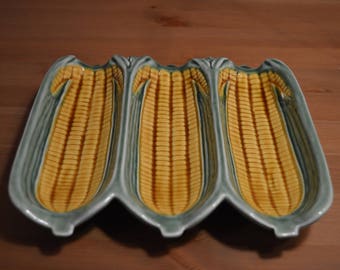
I want to click on tray, so click(171, 232).